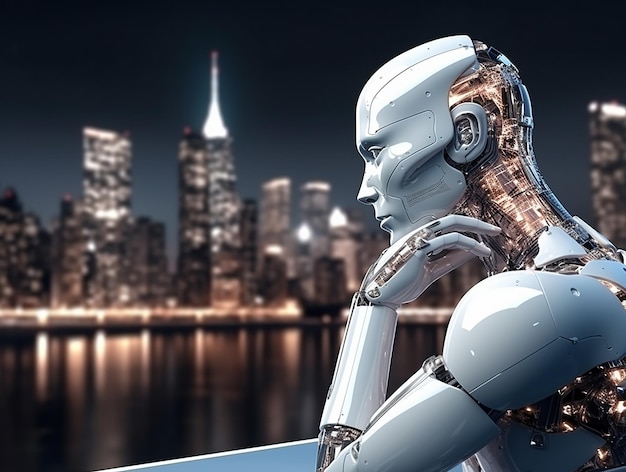
Locate an element on the screen. The height and width of the screenshot is (472, 626). chest is located at coordinates (516, 461).